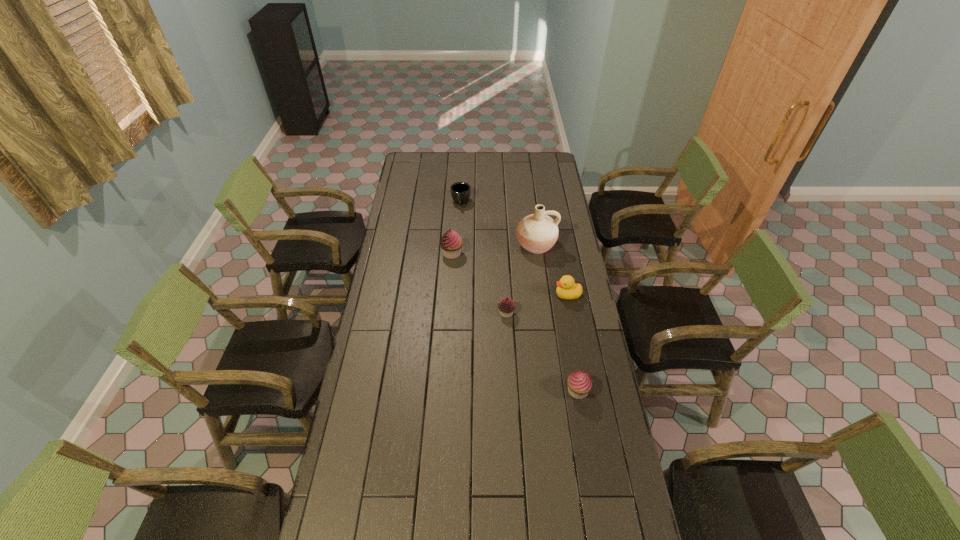
You are a GUI agent. You are given a task and a screenshot of the screen. Output one action in this format:
    pyautogui.click(x=<x>, y=<y>)
    Task: Click on the vacant region located on the left of the third object from left to right
    Image resolution: width=960 pixels, height=540 pixels.
    Given the screenshot: What is the action you would take?
    pyautogui.click(x=431, y=313)

At what (x,y) coordinates should I click in order to perform the action: click on free space located on the front of the rightmost cupcake. Please return your answer as a coordinate pair (x, y). Looking at the image, I should click on (590, 465).

The height and width of the screenshot is (540, 960). I want to click on vacant space situated on the side of the farthest object with the handle, so click(458, 260).

The height and width of the screenshot is (540, 960). Identify the location of vacant space located 0.090m to pour from the handle of the pottery. point(540,273).

The image size is (960, 540). Find the location of `vacant space situated 0.130m at the beak of the third nearest object`. vacant space situated 0.130m at the beak of the third nearest object is located at coordinates (524, 295).

Locate an element on the screen. Image resolution: width=960 pixels, height=540 pixels. free point located 0.400m at the beak of the third nearest object is located at coordinates (463, 295).

Find the location of a particular element. The image size is (960, 540). blank space located at the beak of the third nearest object is located at coordinates click(494, 295).

Where is `cupcake that is at the right edge`? The image size is (960, 540). cupcake that is at the right edge is located at coordinates (580, 383).

Identify the location of pottery positioned at the right edge. (537, 233).

Identify the location of duck that is at the right edge. (567, 289).